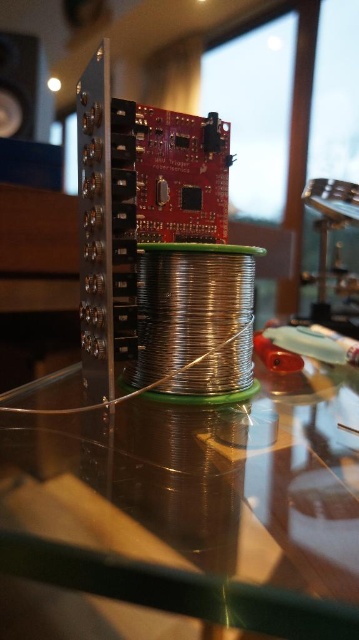
Question: Which object appears farthest from the camera in this image?

Choices:
 (A) black glossy speaker at upper left
 (B) transparent glass table at center

Answer: (A)

Question: Which object is farther from the camera taking this photo?

Choices:
 (A) black glossy speaker at upper left
 (B) transparent glass table at center

Answer: (A)

Question: Is the position of transparent glass table at center less distant than that of black glossy speaker at upper left?

Choices:
 (A) yes
 (B) no

Answer: (A)

Question: Is transparent glass table at center wider than black glossy speaker at upper left?

Choices:
 (A) no
 (B) yes

Answer: (B)

Question: Can you confirm if transparent glass table at center is positioned below black glossy speaker at upper left?

Choices:
 (A) yes
 (B) no

Answer: (A)